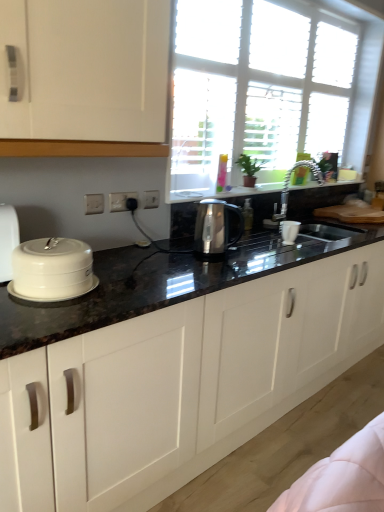
Question: Does satin metallic kettle at center contain white plastic electric outlet at center, which ranks as the 2th electric outlet in front-to-back order?

Choices:
 (A) yes
 (B) no

Answer: (B)

Question: Can you confirm if satin metallic kettle at center is shorter than white plastic electric outlet at center, which ranks as the 2th electric outlet in front-to-back order?

Choices:
 (A) yes
 (B) no

Answer: (B)

Question: Can you confirm if satin metallic kettle at center is taller than white plastic electric outlet at center, which is the 2th electric outlet in left-to-right order?

Choices:
 (A) yes
 (B) no

Answer: (A)

Question: Considering the relative positions of satin metallic kettle at center and white plastic electric outlet at center, which ranks as the 2th electric outlet in front-to-back order, in the image provided, is satin metallic kettle at center in front of white plastic electric outlet at center, which ranks as the 2th electric outlet in front-to-back order,?

Choices:
 (A) yes
 (B) no

Answer: (A)

Question: Is satin metallic kettle at center at the right side of white plastic electric outlet at center, the 2th electric outlet positioned from the right?

Choices:
 (A) no
 (B) yes

Answer: (B)

Question: From the image's perspective, relative to metallic shiny faucet at upper center, is white ceramic lid at left above or below?

Choices:
 (A) above
 (B) below

Answer: (B)

Question: Based on their positions, is white ceramic lid at left located to the left or right of metallic shiny faucet at upper center?

Choices:
 (A) left
 (B) right

Answer: (A)

Question: Do you think white ceramic lid at left is within metallic shiny faucet at upper center, or outside of it?

Choices:
 (A) inside
 (B) outside

Answer: (B)

Question: Is white ceramic lid at left wider or thinner than metallic shiny faucet at upper center?

Choices:
 (A) wide
 (B) thin

Answer: (A)

Question: Looking at their shapes, would you say white ceramic lid at left is wider or thinner than white glossy cabinets at center?

Choices:
 (A) thin
 (B) wide

Answer: (A)

Question: In the image, is white ceramic lid at left positioned in front of or behind white glossy cabinets at center?

Choices:
 (A) behind
 (B) front

Answer: (A)

Question: Considering the positions of white ceramic lid at left and white glossy cabinets at center in the image, is white ceramic lid at left bigger or smaller than white glossy cabinets at center?

Choices:
 (A) small
 (B) big

Answer: (A)

Question: In the image, is white ceramic lid at left on the left side or the right side of white glossy cabinets at center?

Choices:
 (A) right
 (B) left

Answer: (B)

Question: Is point (182, 71) closer or farther from the camera than point (97, 459)?

Choices:
 (A) farther
 (B) closer

Answer: (A)

Question: Would you say transparent glass window at upper center is to the left or to the right of white glossy cabinets at center in the picture?

Choices:
 (A) right
 (B) left

Answer: (A)